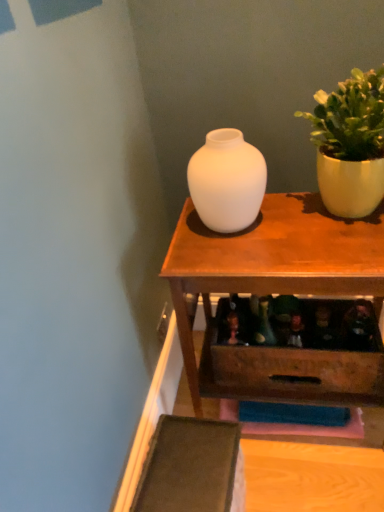
This screenshot has width=384, height=512. Describe the element at coordinates (277, 293) in the screenshot. I see `matte wood table at center` at that location.

Where is `matte wood table at center`? The width and height of the screenshot is (384, 512). matte wood table at center is located at coordinates (277, 293).

From the image's perspective, would you say matte yellow pot at upper right is shown under white matte vase at center?

Actually, matte yellow pot at upper right appears above white matte vase at center in the image.

Find the location of a particular element. The width and height of the screenshot is (384, 512). houseplant located in front of the white matte vase at center is located at coordinates (350, 144).

Relative to white matte vase at center, is matte yellow pot at upper right in front or behind?

Clearly, matte yellow pot at upper right is in front of white matte vase at center.

Does point (251, 150) appear closer or farther from the camera than point (281, 287)?

Point (251, 150).

From the image's perspective, between white matte vase at center and matte wood table at center, which one is located above?

white matte vase at center is shown above in the image.

From a real-world perspective, is white matte vase at center positioned under matte wood table at center based on gravity?

No.

Who is taller, white matte vase at center or matte wood table at center?

With more height is matte wood table at center.

Based on the photo, is the position of white matte vase at center more distant than that of matte yellow pot at upper right?

Yes.

From their relative heights in the image, would you say white matte vase at center is taller or shorter than matte yellow pot at upper right?

Considering their sizes, white matte vase at center has less height than matte yellow pot at upper right.

From a real-world perspective, which object rests below the other?

In real-world perspective, white matte vase at center is lower.

Considering the positions of points (360, 185) and (266, 244), is point (360, 185) closer to camera compared to point (266, 244)?

Yes, point (360, 185) is in front of point (266, 244).

Is matte yellow pot at upper right directly adjacent to matte wood table at center?

They are not placed beside each other.

How many degrees apart are the facing directions of matte yellow pot at upper right and matte wood table at center?

The angular difference between matte yellow pot at upper right and matte wood table at center is 3.36 degrees.

Is matte yellow pot at upper right bigger than matte wood table at center?

No.

From the image's perspective, is matte wood table at center above white matte vase at center?

No, from the image's perspective, matte wood table at center is not over white matte vase at center.

Is point (337, 352) in front of point (221, 186)?

No, (337, 352) is further to viewer.

How many degrees apart are the facing directions of matte wood table at center and white matte vase at center?

The facing directions of matte wood table at center and white matte vase at center are 0.121 degrees apart.

In the image, there is a white matte vase at center. At what (x,y) coordinates should I click in order to perform the action: click on table below it (from the image's perspective). Please return your answer as a coordinate pair (x, y). Looking at the image, I should click on (277, 293).

Is matte wood table at center wider than matte yellow pot at upper right?

Yes.

Is matte wood table at center completely or partially outside of matte yellow pot at upper right?

matte wood table at center is positioned outside matte yellow pot at upper right.

Is matte wood table at center to the left of matte yellow pot at upper right from the viewer's perspective?

Yes.

Image resolution: width=384 pixels, height=512 pixels. What are the coordinates of `vase located behind the matte yellow pot at upper right` in the screenshot? It's located at (227, 181).

Identify the location of table on the right of white matte vase at center. The image size is (384, 512). (277, 293).

Considering their positions, is matte wood table at center positioned closer to white matte vase at center than matte yellow pot at upper right?

Among the two, matte wood table at center is located nearer to white matte vase at center.

Based on their spatial positions, is white matte vase at center or matte wood table at center further from matte yellow pot at upper right?

matte wood table at center.

Estimate the real-world distances between objects in this image. Which object is further from matte wood table at center, white matte vase at center or matte yellow pot at upper right?

Among the two, matte yellow pot at upper right is located further to matte wood table at center.

Based on their spatial positions, is matte yellow pot at upper right or white matte vase at center further from matte wood table at center?

matte yellow pot at upper right is positioned further to the anchor matte wood table at center.

Based on their spatial positions, is matte yellow pot at upper right or matte wood table at center further from white matte vase at center?

Based on the image, matte yellow pot at upper right appears to be further to white matte vase at center.

Looking at the image, which one is located further to matte yellow pot at upper right, matte wood table at center or white matte vase at center?

The object further to matte yellow pot at upper right is matte wood table at center.

This screenshot has height=512, width=384. Find the location of `vase that lies between matte yellow pot at upper right and matte wood table at center from top to bottom`. vase that lies between matte yellow pot at upper right and matte wood table at center from top to bottom is located at coordinates (227, 181).